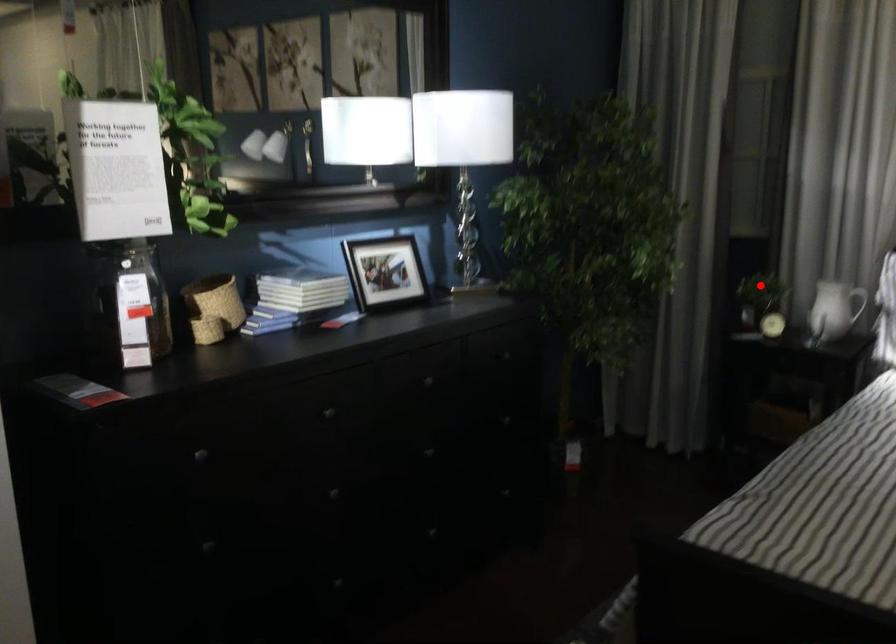
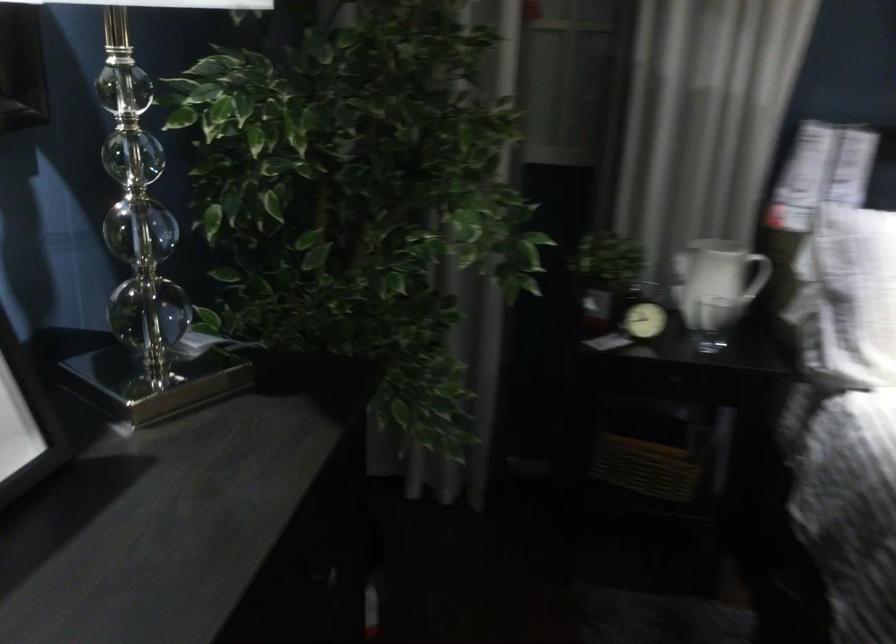
Question: I am providing you with two images of the same scene from different viewpoints. Image1 has a red point marked. In image2, the corresponding 3D location appears at what relative position? Reply with the corresponding letter.

Choices:
 (A) Closer
 (B) Farther

Answer: (A)